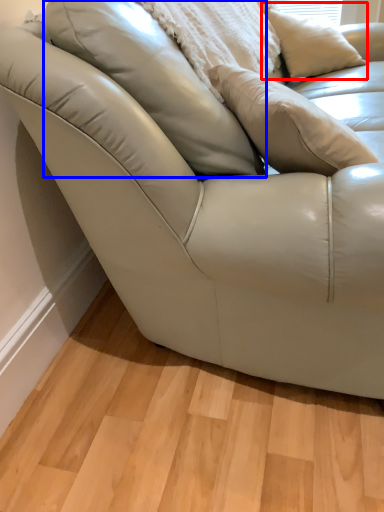
Question: Among these objects, which one is farthest to the camera, pillow (highlighted by a red box) or pillow (highlighted by a blue box)?

Choices:
 (A) pillow
 (B) pillow

Answer: (A)